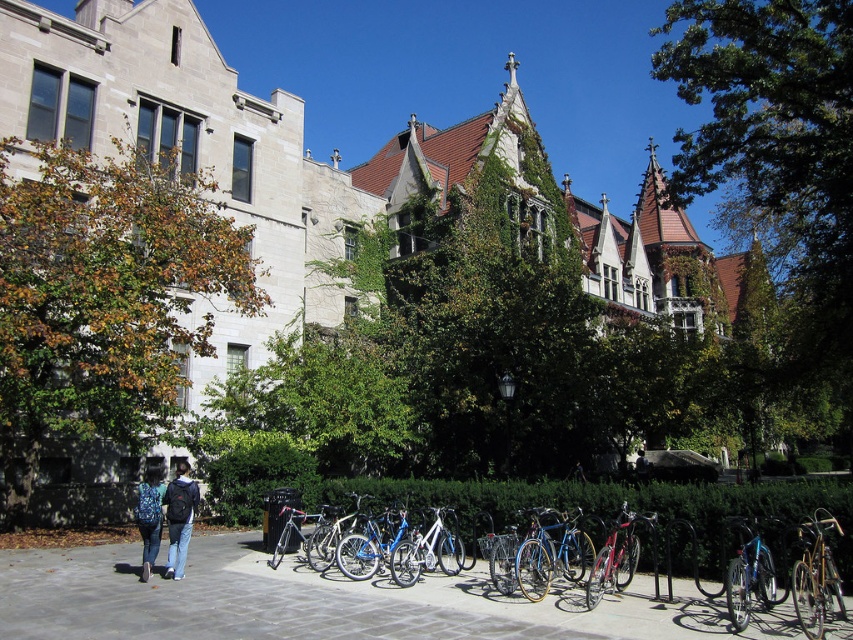
You are standing at the point closer to the camera between the two points, point 1 at (x=350, y=529) and point 2 at (x=289, y=525). If you walk straight ahead, will you first encounter the building on the left or the building on the right?

The point closer to the camera is point 2 at (x=289, y=525). Since you are walking straight ahead from this point, you would first encounter the building on the left before reaching the building on the right.

You are a campus tour guide and need to park both the silver metallic bicycle at center and the shiny silver bicycle at center along a narrow walkway. Given their sizes, which bicycle will require more space to park?

The shiny silver bicycle at center requires more space to park because it occupies more space than the silver metallic bicycle at center according to the description.